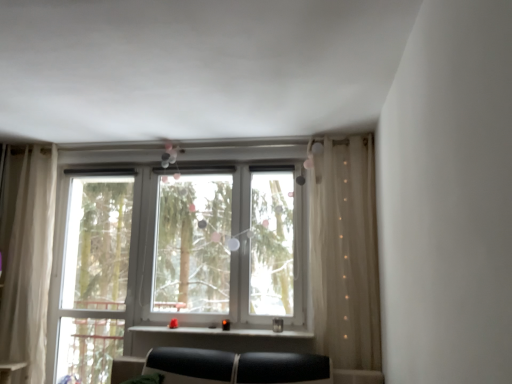
Question: From a real-world perspective, is sheer white curtain at left, positioned as the 2th curtain in right-to-left order, positioned under sheer beige curtain at right, the 2th curtain in the left-to-right sequence, based on gravity?

Choices:
 (A) no
 (B) yes

Answer: (B)

Question: From the image's perspective, is sheer white curtain at left, positioned as the 2th curtain in right-to-left order, located beneath sheer beige curtain at right, which is the 1th curtain from right to left?

Choices:
 (A) no
 (B) yes

Answer: (B)

Question: From the image's perspective, is sheer white curtain at left, positioned as the 2th curtain in right-to-left order, over sheer beige curtain at right, the 2th curtain in the left-to-right sequence?

Choices:
 (A) no
 (B) yes

Answer: (A)

Question: Does sheer white curtain at left, the 1th curtain positioned from the left, have a lesser width compared to sheer beige curtain at right, which is the 1th curtain from right to left?

Choices:
 (A) yes
 (B) no

Answer: (A)

Question: Is sheer white curtain at left, positioned as the 2th curtain in right-to-left order, wider than sheer beige curtain at right, which is the 1th curtain from right to left?

Choices:
 (A) yes
 (B) no

Answer: (B)

Question: Is sheer white curtain at left, the 1th curtain positioned from the left, oriented towards sheer beige curtain at right, which is the 1th curtain from right to left?

Choices:
 (A) yes
 (B) no

Answer: (B)

Question: Does clear glass window at left have a larger size compared to sheer beige curtain at right, the 2th curtain in the left-to-right sequence?

Choices:
 (A) yes
 (B) no

Answer: (B)

Question: Considering the relative positions of clear glass window at left and sheer beige curtain at right, the 2th curtain in the left-to-right sequence, in the image provided, is clear glass window at left to the left of sheer beige curtain at right, the 2th curtain in the left-to-right sequence, from the viewer's perspective?

Choices:
 (A) no
 (B) yes

Answer: (B)

Question: From the image's perspective, is clear glass window at left located beneath sheer beige curtain at right, the 2th curtain in the left-to-right sequence?

Choices:
 (A) yes
 (B) no

Answer: (A)

Question: From a real-world perspective, is clear glass window at left on sheer beige curtain at right, the 2th curtain in the left-to-right sequence?

Choices:
 (A) no
 (B) yes

Answer: (A)

Question: Considering the relative sizes of clear glass window at left and sheer beige curtain at right, which is the 1th curtain from right to left, in the image provided, is clear glass window at left wider than sheer beige curtain at right, which is the 1th curtain from right to left,?

Choices:
 (A) no
 (B) yes

Answer: (A)

Question: Is clear glass window at left directly adjacent to sheer beige curtain at right, which is the 1th curtain from right to left?

Choices:
 (A) no
 (B) yes

Answer: (A)

Question: Is matte black window sill at center wider than white plastic bay window at center?

Choices:
 (A) yes
 (B) no

Answer: (A)